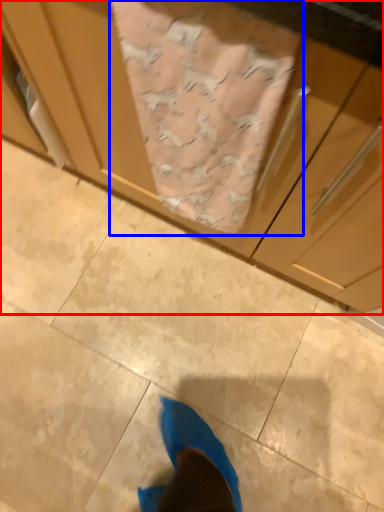
Question: Which point is closer to the camera, cabinetry (highlighted by a red box) or blanket (highlighted by a blue box)?

Choices:
 (A) cabinetry
 (B) blanket

Answer: (A)